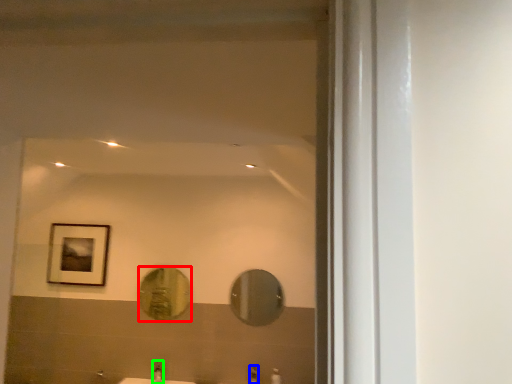
Question: Which object is the farthest from mirror (highlighted by a red box)? Choose among these: faucet (highlighted by a blue box) or faucet (highlighted by a green box).

Choices:
 (A) faucet
 (B) faucet

Answer: (A)